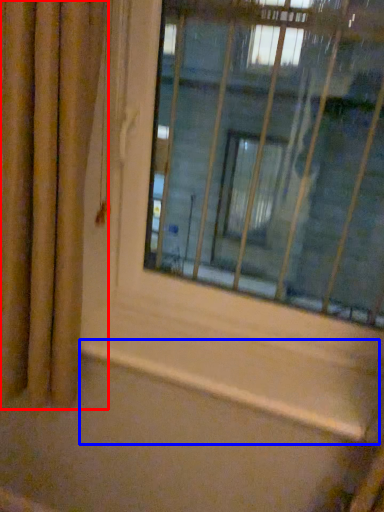
Question: Which point is further to the camera, curtain (highlighted by a red box) or window sill (highlighted by a blue box)?

Choices:
 (A) curtain
 (B) window sill

Answer: (B)